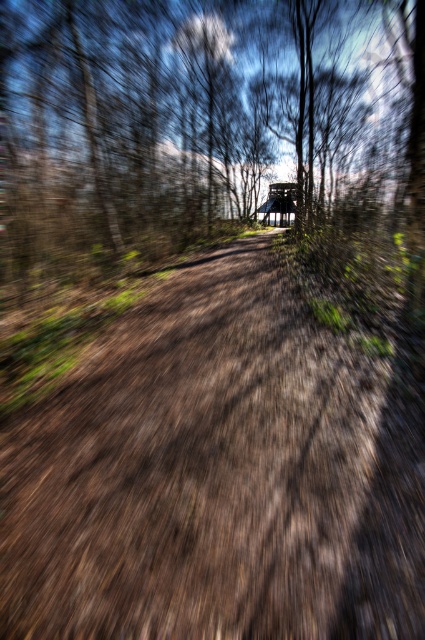
Looking at this image, you are a hiker who has just started walking on the brown dirt track at center. If your average walking speed is 3 feet per second, how many seconds will it take you to reach the end of the track?

The brown dirt track at center is 6.37 feet away from the camera. At a walking speed of 3 feet per second, it would take approximately 2.12 seconds to reach the end of the track.

You are standing at the starting point of the forest path and want to reach the structure in the distance. According to the image, where exactly is the brown dirt track at center located?

The brown dirt track at center is located at point (215, 476).